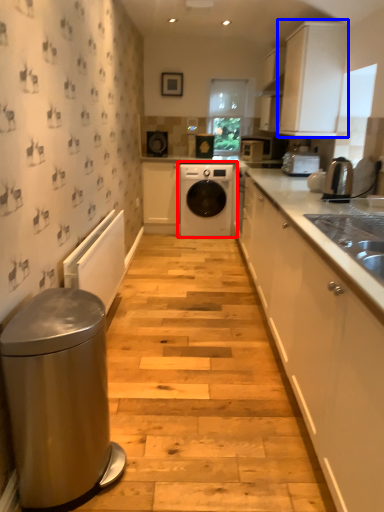
Question: Which point is further to the camera, washing machine (highlighted by a red box) or cabinetry (highlighted by a blue box)?

Choices:
 (A) washing machine
 (B) cabinetry

Answer: (A)